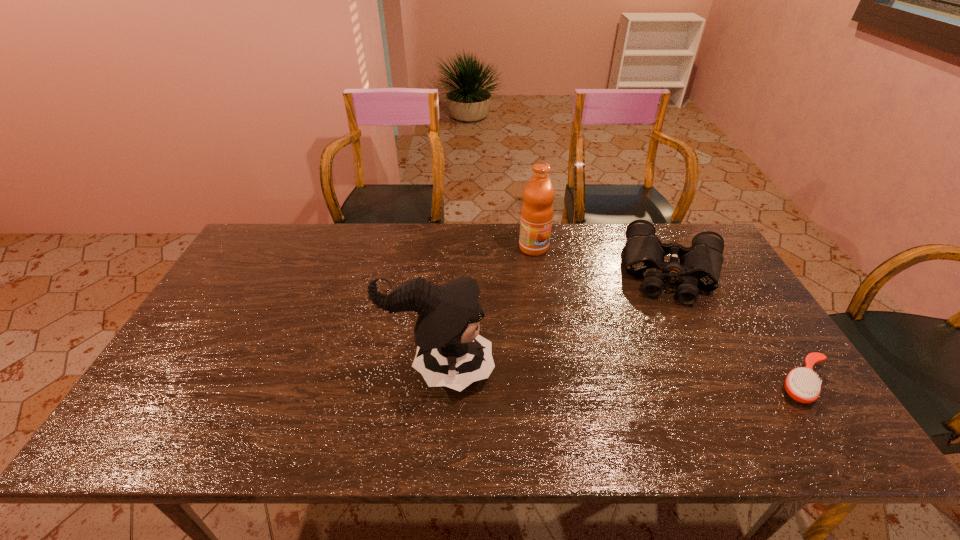
The width and height of the screenshot is (960, 540). Find the location of `the leftmost object`. the leftmost object is located at coordinates (450, 352).

Find the location of a particular element. The height and width of the screenshot is (540, 960). the shortest object is located at coordinates (802, 384).

Where is `the third tallest object`? the third tallest object is located at coordinates (699, 266).

Identify the location of fruit juice. (537, 210).

Find the location of `blank space located at the face of the doll`. blank space located at the face of the doll is located at coordinates (625, 368).

You are a GUI agent. You are given a task and a screenshot of the screen. Output one action in this format:
    pyautogui.click(x=<x>, y=<y>)
    Task: Click on the blank space located 0.240m on the left of the hairbrush
    
    Given the screenshot: What is the action you would take?
    pyautogui.click(x=677, y=383)

Where is `free space located through the eyepieces of the binoculars`? free space located through the eyepieces of the binoculars is located at coordinates (673, 341).

In order to click on free spot located 0.080m through the eyepieces of the binoculars in this screenshot , I will do `click(673, 325)`.

The height and width of the screenshot is (540, 960). In order to click on free region located 0.270m through the eyepieces of the binoculars in this screenshot , I will do `click(673, 379)`.

The width and height of the screenshot is (960, 540). I want to click on blank area located 0.060m on the label side of the second object from left to right, so click(x=553, y=266).